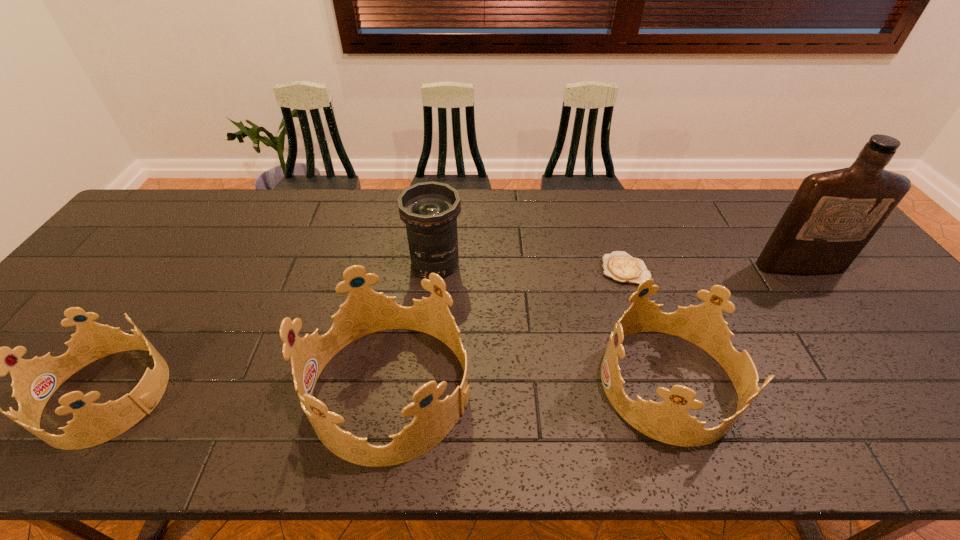
At what (x,y) coordinates should I click in order to perform the action: click on free space that is in between the second tallest tiara and the fifth tallest object. Please return your answer as a coordinate pair (x, y). This screenshot has height=540, width=960. Looking at the image, I should click on (389, 389).

At what (x,y) coordinates should I click in order to perform the action: click on free space between the second tiara from left to right and the leftmost object. Please return your answer as a coordinate pair (x, y). This screenshot has width=960, height=540. Looking at the image, I should click on (x=250, y=392).

Identify the location of vacant area that lies between the telephoto lens and the rightmost tiara. (552, 323).

The width and height of the screenshot is (960, 540). In order to click on free point between the liquor and the shortest object in this screenshot , I will do `click(712, 268)`.

Select which object appears as the third closest to the second tiara from right to left. Please provide its 2D coordinates. Your answer should be formatted as a tuple, i.e. [(x, y)], where the tuple contains the x and y coordinates of a point satisfying the conditions above.

[(34, 381)]

The width and height of the screenshot is (960, 540). Find the location of `object identified as the fourth closest to the fifth tallest object`. object identified as the fourth closest to the fifth tallest object is located at coordinates (620, 266).

Locate which tiara is the closest to the second tiara from right to left. Please provide its 2D coordinates. Your answer should be formatted as a tuple, i.e. [(x, y)], where the tuple contains the x and y coordinates of a point satisfying the conditions above.

[(668, 421)]

Identify which tiara is the closest to the telephoto lens. Please provide its 2D coordinates. Your answer should be formatted as a tuple, i.e. [(x, y)], where the tuple contains the x and y coordinates of a point satisfying the conditions above.

[(365, 311)]

Where is `vacant space that satisfies the following two spatial constraints: 1. on the label side of the rightmost object; 2. on the front-facing side of the rightmost tiara`? The image size is (960, 540). vacant space that satisfies the following two spatial constraints: 1. on the label side of the rightmost object; 2. on the front-facing side of the rightmost tiara is located at coordinates (886, 383).

This screenshot has height=540, width=960. What are the coordinates of `blank space that satisfies the following two spatial constraints: 1. on the label side of the tallest object; 2. on the front-facing side of the second tiara from left to right` in the screenshot? It's located at (891, 389).